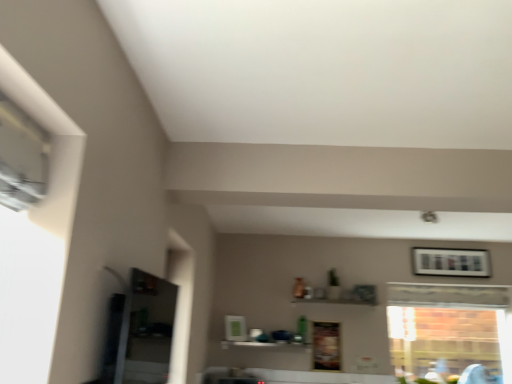
Question: From a real-world perspective, is wooden framed picture at upper right positioned under clear glass window at right based on gravity?

Choices:
 (A) no
 (B) yes

Answer: (A)

Question: Considering the relative sizes of wooden framed picture at upper right and clear glass window at right in the image provided, is wooden framed picture at upper right shorter than clear glass window at right?

Choices:
 (A) no
 (B) yes

Answer: (B)

Question: Is wooden framed picture at upper right bigger than clear glass window at right?

Choices:
 (A) yes
 (B) no

Answer: (B)

Question: Is wooden framed picture at upper right taller than clear glass window at right?

Choices:
 (A) no
 (B) yes

Answer: (A)

Question: Is wooden framed picture at upper right wider than clear glass window at right?

Choices:
 (A) no
 (B) yes

Answer: (A)

Question: From a real-world perspective, is clear glass window at right positioned above or below wooden framed picture at upper right?

Choices:
 (A) below
 (B) above

Answer: (A)

Question: Which is correct: clear glass window at right is inside wooden framed picture at upper right, or outside of it?

Choices:
 (A) inside
 (B) outside

Answer: (B)

Question: Considering the relative positions of clear glass window at right and wooden framed picture at upper right in the image provided, is clear glass window at right to the left or to the right of wooden framed picture at upper right?

Choices:
 (A) right
 (B) left

Answer: (B)

Question: Is clear glass window at right wider or thinner than wooden framed picture at upper right?

Choices:
 (A) thin
 (B) wide

Answer: (B)

Question: Which is correct: clear glass window at right is inside white glossy shelf at center, or outside of it?

Choices:
 (A) outside
 (B) inside

Answer: (A)

Question: Is point (414, 317) positioned closer to the camera than point (226, 340)?

Choices:
 (A) farther
 (B) closer

Answer: (A)

Question: From a real-world perspective, is clear glass window at right positioned above or below white glossy shelf at center?

Choices:
 (A) above
 (B) below

Answer: (A)

Question: Relative to white glossy shelf at center, is clear glass window at right in front or behind?

Choices:
 (A) front
 (B) behind

Answer: (B)

Question: From a real-world perspective, is wooden framed picture at upper right physically located above or below clear glass window at right?

Choices:
 (A) above
 (B) below

Answer: (A)

Question: Is point (464, 259) positioned closer to the camera than point (453, 324)?

Choices:
 (A) farther
 (B) closer

Answer: (B)